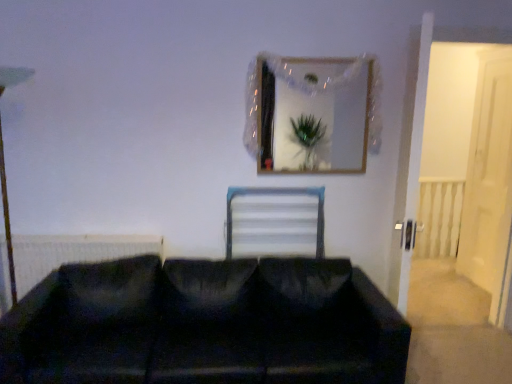
Image resolution: width=512 pixels, height=384 pixels. What do you see at coordinates (311, 113) in the screenshot?
I see `wooden frame at upper center` at bounding box center [311, 113].

This screenshot has height=384, width=512. What do you see at coordinates (72, 253) in the screenshot?
I see `black matte radiator at left` at bounding box center [72, 253].

You are a GUI agent. You are given a task and a screenshot of the screen. Output one action in this format:
    pyautogui.click(x=<x>, y=<y>)
    Task: Click on the white glossy door at right
    The image size is (512, 384).
    Given the screenshot: What is the action you would take?
    pyautogui.click(x=489, y=181)

Where is `black fabric studio couch at lower center`? This screenshot has width=512, height=384. black fabric studio couch at lower center is located at coordinates (205, 325).

Image resolution: width=512 pixels, height=384 pixels. I want to click on wooden frame at upper center, so click(311, 113).

The width and height of the screenshot is (512, 384). In order to click on studio couch that appears below the white glossy door at right (from the image's perspective) in this screenshot , I will do `click(205, 325)`.

From a real-world perspective, is black fabric studio couch at lower center over white glossy door at right?

No, from a real-world perspective, black fabric studio couch at lower center is not on top of white glossy door at right.

Which of these two, black fabric studio couch at lower center or white glossy door at right, stands taller?

white glossy door at right is taller.

Are black fabric studio couch at lower center and white glossy door at right making contact?

No, black fabric studio couch at lower center is not touching white glossy door at right.

Considering their positions, is white glossy door at right located in front of or behind black fabric studio couch at lower center?

white glossy door at right is behind black fabric studio couch at lower center.

This screenshot has width=512, height=384. Find the location of `glass door on the right of black fabric studio couch at lower center`. glass door on the right of black fabric studio couch at lower center is located at coordinates (489, 181).

Is white glossy door at right facing towards black fabric studio couch at lower center?

No, white glossy door at right is not aimed at black fabric studio couch at lower center.

Considering the sizes of objects white glossy door at right and black fabric studio couch at lower center in the image provided, who is thinner, white glossy door at right or black fabric studio couch at lower center?

Thinner between the two is white glossy door at right.

Find the location of a particular element. The height and width of the screenshot is (384, 512). studio couch below the wooden frame at upper center (from the image's perspective) is located at coordinates (205, 325).

Which is closer to the camera, (272, 373) or (356, 145)?

Point (272, 373) appears to be closer to the viewer than point (356, 145).

Is black fabric studio couch at lower center not close to wooden frame at upper center?

Yes, black fabric studio couch at lower center and wooden frame at upper center are located far from each other.

From the image's perspective, is black fabric studio couch at lower center above wooden frame at upper center?

No, from the image's perspective, black fabric studio couch at lower center is not above wooden frame at upper center.

Is black matte radiator at left located outside white glossy door at right?

Yes, black matte radiator at left is outside of white glossy door at right.

Is black matte radiator at left positioned with its back to white glossy door at right?

No, black matte radiator at left is not facing the opposite direction of white glossy door at right.

Where is `glass door behind the black matte radiator at left`? The width and height of the screenshot is (512, 384). glass door behind the black matte radiator at left is located at coordinates (489, 181).

Which object is further away from the camera, black matte radiator at left or white glossy door at right?

white glossy door at right is further away from the camera.

Is black fabric studio couch at lower center shorter than white plastic radiator at center?

In fact, black fabric studio couch at lower center may be taller than white plastic radiator at center.

Considering the relative sizes of black fabric studio couch at lower center and white plastic radiator at center in the image provided, is black fabric studio couch at lower center thinner than white plastic radiator at center?

No, black fabric studio couch at lower center is not thinner than white plastic radiator at center.

Is black fabric studio couch at lower center in front of white plastic radiator at center?

Yes, it is in front of white plastic radiator at center.

In terms of width, does wooden frame at upper center look wider or thinner when compared to black fabric studio couch at lower center?

Clearly, wooden frame at upper center has less width compared to black fabric studio couch at lower center.

Does wooden frame at upper center turn towards black fabric studio couch at lower center?

No.

Is wooden frame at upper center to the left of black fabric studio couch at lower center from the viewer's perspective?

In fact, wooden frame at upper center is to the right of black fabric studio couch at lower center.

From a real-world perspective, is wooden frame at upper center over black fabric studio couch at lower center?

Indeed, from a real-world perspective, wooden frame at upper center stands above black fabric studio couch at lower center.

Which object is further away from the camera taking this photo, black matte radiator at left or wooden frame at upper center?

wooden frame at upper center is further away from the camera.

Is black matte radiator at left aimed at wooden frame at upper center?

No, black matte radiator at left is not oriented towards wooden frame at upper center.

Is black matte radiator at left far away from wooden frame at upper center?

Indeed, black matte radiator at left is not near wooden frame at upper center.

At what (x,y) coordinates should I click in order to perform the action: click on picture frame that appears behind the black matte radiator at left. Please return your answer as a coordinate pair (x, y). Looking at the image, I should click on (311, 113).

Where is `studio couch in front of the white glossy door at right`? studio couch in front of the white glossy door at right is located at coordinates (205, 325).

Where is `studio couch on the left of the white glossy door at right`? The image size is (512, 384). studio couch on the left of the white glossy door at right is located at coordinates (205, 325).

From the image, which object appears to be farther from black matte radiator at left, white glossy door at right or white plastic radiator at center?

Among the two, white glossy door at right is located further to black matte radiator at left.

In the scene shown: Estimate the real-world distances between objects in this image. Which object is further from black fabric studio couch at lower center, black matte radiator at left or white glossy door at right?

Based on the image, white glossy door at right appears to be further to black fabric studio couch at lower center.

Considering their positions, is wooden frame at upper center positioned closer to black matte radiator at left than black fabric studio couch at lower center?

black fabric studio couch at lower center.

Which object lies nearer to the anchor point white plastic radiator at center, black matte radiator at left or white glossy door at right?

The object closer to white plastic radiator at center is black matte radiator at left.

Which object lies further to the anchor point white plastic radiator at center, black fabric studio couch at lower center or black matte radiator at left?

Among the two, black matte radiator at left is located further to white plastic radiator at center.

Which object lies nearer to the anchor point white plastic radiator at center, white glossy door at right or black matte radiator at left?

black matte radiator at left is positioned closer to the anchor white plastic radiator at center.

When comparing their distances from black fabric studio couch at lower center, does white glossy door at right or black matte radiator at left seem closer?

Among the two, black matte radiator at left is located nearer to black fabric studio couch at lower center.

Considering their positions, is black matte radiator at left positioned further to black fabric studio couch at lower center than white plastic radiator at center?

white plastic radiator at center lies further to black fabric studio couch at lower center than the other object.

At what (x,y) coordinates should I click in order to perform the action: click on furniture situated between black matte radiator at left and white glossy door at right from left to right. Please return your answer as a coordinate pair (x, y). The width and height of the screenshot is (512, 384). Looking at the image, I should click on (278, 194).

You are a GUI agent. You are given a task and a screenshot of the screen. Output one action in this format:
    pyautogui.click(x=<x>, y=<y>)
    Task: Click on the furniture located between black fabric studio couch at lower center and white glossy door at right in the left-right direction
    Image resolution: width=512 pixels, height=384 pixels.
    Given the screenshot: What is the action you would take?
    pyautogui.click(x=278, y=194)

Find the location of a particular element. picture frame located between white plastic radiator at center and white glossy door at right in the left-right direction is located at coordinates (311, 113).

This screenshot has height=384, width=512. Find the location of `studio couch situated between black matte radiator at left and white plastic radiator at center from left to right`. studio couch situated between black matte radiator at left and white plastic radiator at center from left to right is located at coordinates (205, 325).